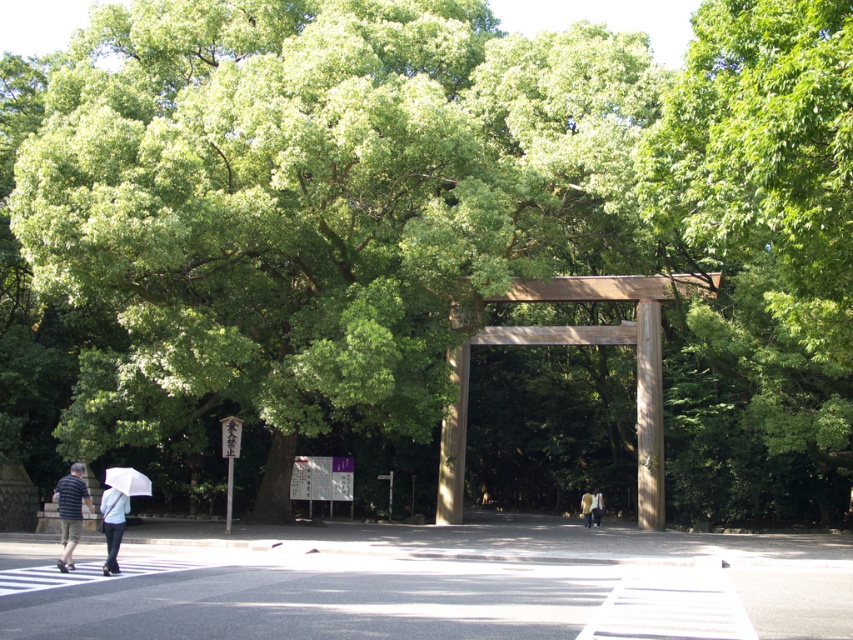
Can you confirm if wooden torii gate at center is thinner than yellow-green fabric umbrella at center?

Incorrect, wooden torii gate at center's width is not less than yellow-green fabric umbrella at center's.

Does wooden torii gate at center have a smaller size compared to yellow-green fabric umbrella at center?

Incorrect, wooden torii gate at center is not smaller in size than yellow-green fabric umbrella at center.

What do you see at coordinates (578, 342) in the screenshot? I see `wooden torii gate at center` at bounding box center [578, 342].

Locate an element on the screen. This screenshot has width=853, height=640. wooden torii gate at center is located at coordinates (578, 342).

Does wooden torii gate at center appear on the right side of white matte umbrella at lower left?

Indeed, wooden torii gate at center is positioned on the right side of white matte umbrella at lower left.

Which of these two, wooden torii gate at center or white matte umbrella at lower left, stands taller?

wooden torii gate at center

At what (x,y) coordinates should I click in order to perform the action: click on wooden torii gate at center. Please return your answer as a coordinate pair (x, y). Looking at the image, I should click on (578, 342).

Who is higher up, matte white umbrella at lower left or yellow-green fabric umbrella at center?

Positioned higher is matte white umbrella at lower left.

Who is shorter, matte white umbrella at lower left or yellow-green fabric umbrella at center?

With less height is matte white umbrella at lower left.

Is point (114, 548) behind point (590, 513)?

No, (114, 548) is in front of (590, 513).

This screenshot has width=853, height=640. Identify the location of matte white umbrella at lower left. (70, 512).